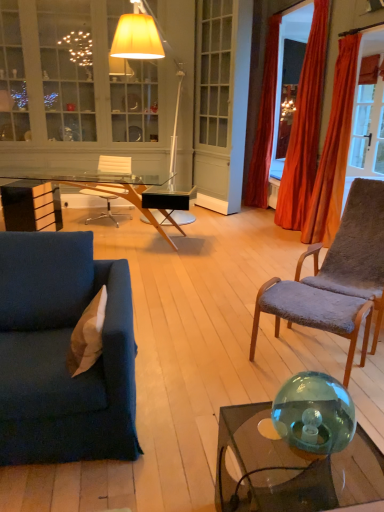
In order to click on vacant space situated above transparent glass coffee table at lower right (from a real-world perspective) in this screenshot , I will do `click(283, 448)`.